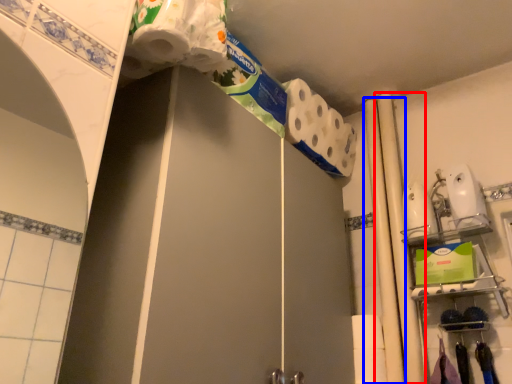
Question: Which of the following is the farthest to the observer, beam (highlighted by a red box) or beam (highlighted by a blue box)?

Choices:
 (A) beam
 (B) beam

Answer: (B)